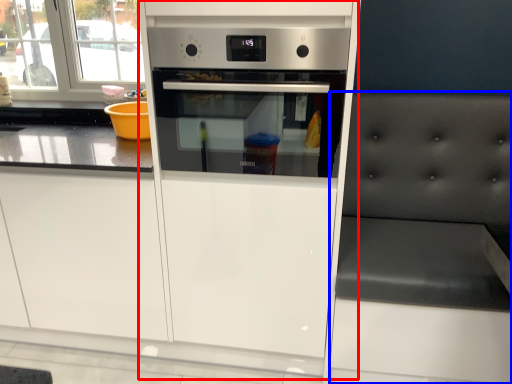
Question: Which object is closer to the camera taking this photo, fridge (highlighted by a red box) or chair (highlighted by a blue box)?

Choices:
 (A) fridge
 (B) chair

Answer: (B)